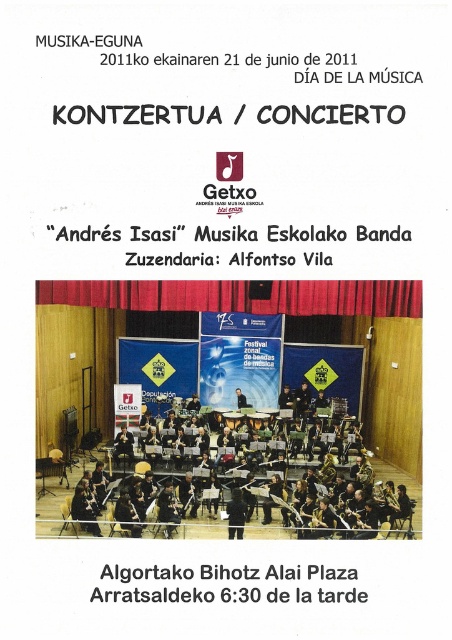
Which is behind, point (376, 467) or point (277, 500)?

Positioned behind is point (376, 467).

Is point (178, 474) farther from camera compared to point (290, 506)?

Yes.

Between point (399, 506) and point (291, 502), which one is positioned behind?

The point (291, 502) is behind.

Where is `black metallic instruments at center`? The image size is (452, 640). black metallic instruments at center is located at coordinates (205, 490).